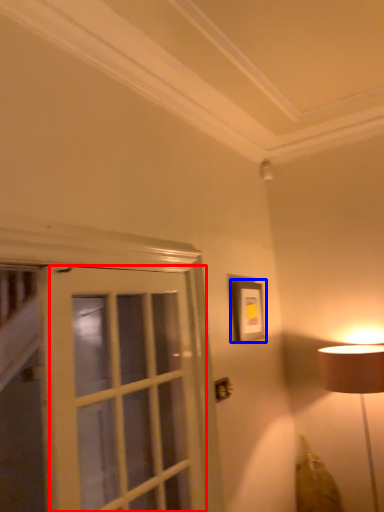
Question: Which object is further to the camera taking this photo, screen door (highlighted by a red box) or picture frame (highlighted by a blue box)?

Choices:
 (A) screen door
 (B) picture frame

Answer: (B)